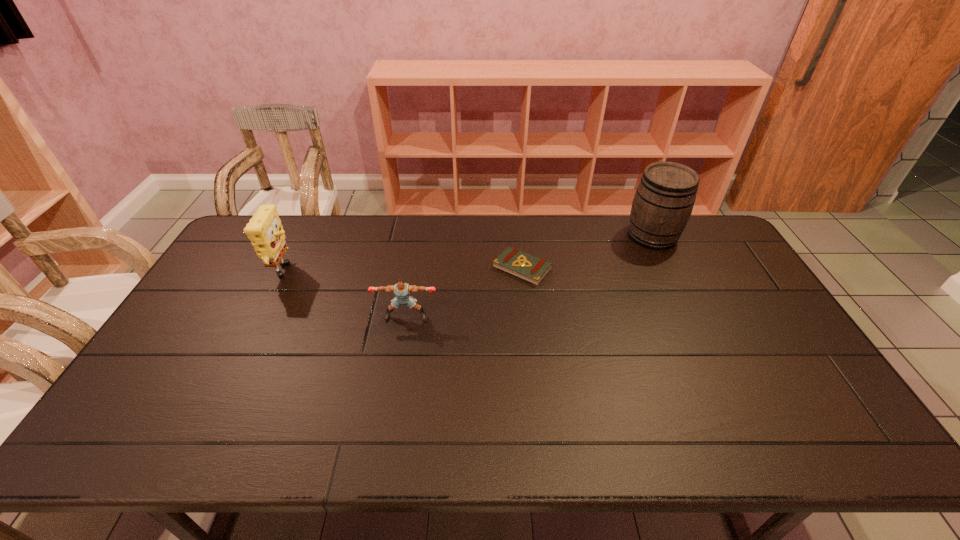
At what (x,y) coordinates should I click in order to perform the action: click on free region at the near left corner of the desktop. Please return your answer as a coordinate pair (x, y). Looking at the image, I should click on (140, 441).

The height and width of the screenshot is (540, 960). In the image, there is a desktop. What are the coordinates of `free region at the near right corner` in the screenshot? It's located at (862, 439).

The image size is (960, 540). In order to click on free space between the puncher and the sponge in this screenshot , I will do `click(345, 295)`.

The height and width of the screenshot is (540, 960). Find the location of `free space between the sponge and the third tallest object`. free space between the sponge and the third tallest object is located at coordinates point(345,295).

What are the coordinates of `empty space that is in between the nearest object and the shortest object` in the screenshot? It's located at 465,292.

You are a GUI agent. You are given a task and a screenshot of the screen. Output one action in this format:
    pyautogui.click(x=<x>, y=<y>)
    Task: Click on the free spot between the wine bucket and the leftmost object
    
    Given the screenshot: What is the action you would take?
    pyautogui.click(x=468, y=255)

Image resolution: width=960 pixels, height=540 pixels. I want to click on vacant space in between the wine bucket and the second tallest object, so click(468, 255).

I want to click on empty location between the second shortest object and the shortest object, so click(465, 292).

This screenshot has height=540, width=960. I want to click on unoccupied area between the third object from left to right and the sponge, so click(403, 271).

Where is `empty location between the wine bucket and the leftmost object`? The height and width of the screenshot is (540, 960). empty location between the wine bucket and the leftmost object is located at coordinates (468, 255).